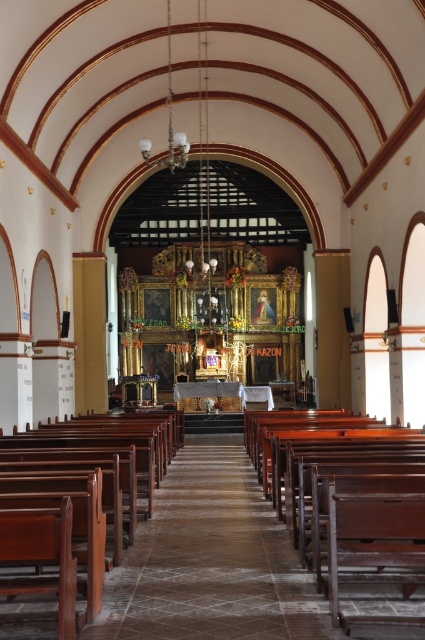
Can you confirm if mahogany wood church bench at center is shorter than brown polished wood church bench at center?

Indeed, mahogany wood church bench at center has a lesser height compared to brown polished wood church bench at center.

Who is lower down, mahogany wood church bench at center or brown polished wood church bench at center?

brown polished wood church bench at center is lower down.

Does point (312, 531) come behind point (150, 436)?

No, (312, 531) is closer to viewer.

This screenshot has height=640, width=425. I want to click on mahogany wood church bench at center, so click(x=320, y=465).